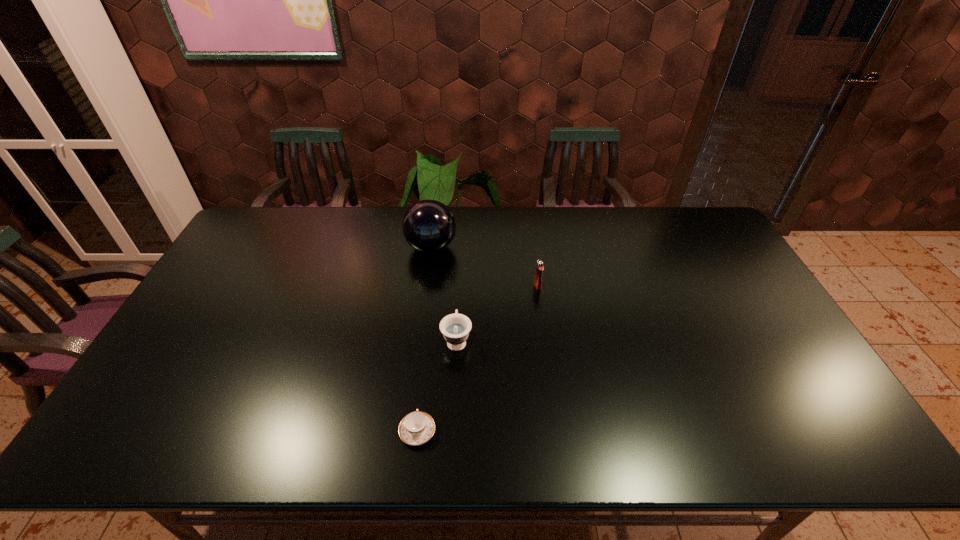
Identify the location of vacant position located on the side of the taller teacup with the handle. (458, 309).

The image size is (960, 540). Find the location of `vacant space located on the side of the taller teacup with the handle`. vacant space located on the side of the taller teacup with the handle is located at coordinates (459, 302).

At what (x,y) coordinates should I click in order to perform the action: click on vacant area located on the side of the taller teacup with the handle. Please return your answer as a coordinate pair (x, y). Looking at the image, I should click on (460, 267).

Find the location of a particular element. This screenshot has height=540, width=960. vacant space situated on the side with the handle of the shortest object is located at coordinates (426, 352).

Where is `vacant space located 0.130m on the side with the handle of the shortest object`? vacant space located 0.130m on the side with the handle of the shortest object is located at coordinates (424, 370).

Find the location of `vacant space located on the side with the handle of the shortest object`. vacant space located on the side with the handle of the shortest object is located at coordinates (x=430, y=313).

Find the location of `object at the far edge`. object at the far edge is located at coordinates (428, 226).

Find the location of a particular element. object at the near edge is located at coordinates (416, 428).

Locate an element on the screen. free space at the far edge is located at coordinates (625, 216).

The width and height of the screenshot is (960, 540). In the image, there is a desktop. Identify the location of free region at the near edge. (406, 446).